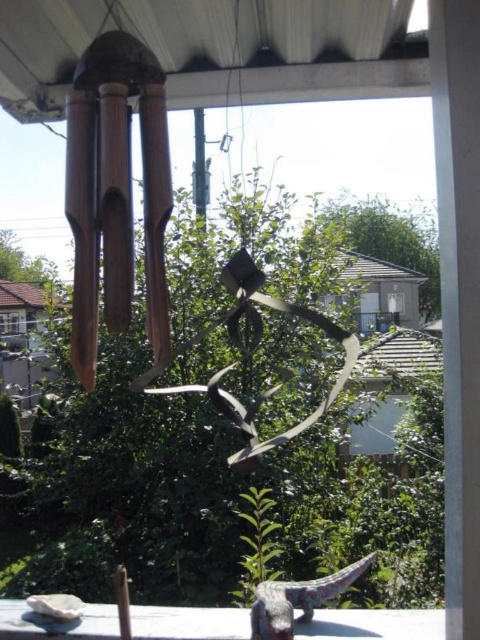
You are a guest at a garden party and want to place a tall flower vase on the white stone table at lower center. The metallic silver star at center is nearby. Can the flower vase fit on the table without touching the star?

The white stone table at lower center is shorter than the metallic silver star at center. Since the table is shorter, placing a tall flower vase on it might cause it to touch the star if the vase exceeds the table height. Check the vase height against both objects to ensure clearance.

You are a guest at a party and want to take a photo of the metallic silver star at center without the white stone table at lower center blocking the view. How should you position yourself?

Move behind the white stone table at lower center so that the metallic silver star at center, which is behind the table, becomes visible without obstruction.

You are standing on the balcony and want to place a new plant pot between the metallic silver star at center and the multicolored plastic lizard at lower center. Based on their positions, which direction should you place the pot relative to the lizard?

The metallic silver star at center is to the left of the multicolored plastic lizard at lower center, so you should place the pot to the left of the lizard.